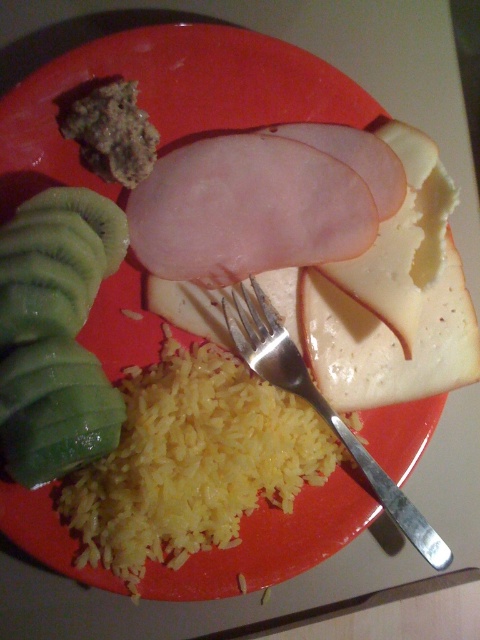
Question: Which object appears farthest from the camera in this image?

Choices:
 (A) silver metallic fork at center
 (B) white/semi-hard cheese at center

Answer: (B)

Question: Considering the real-world distances, which object is farthest from the white/semi-hard cheese at center?

Choices:
 (A) silver metallic fork at center
 (B) yellow matte rice at center

Answer: (B)

Question: Does white/semi-hard cheese at center come behind green juicy kiwi at left?

Choices:
 (A) yes
 (B) no

Answer: (A)

Question: Considering the relative positions of white/semi-hard cheese at center and green juicy kiwi at left in the image provided, where is white/semi-hard cheese at center located with respect to green juicy kiwi at left?

Choices:
 (A) right
 (B) left

Answer: (A)

Question: Can you confirm if yellow matte rice at center is smaller than green juicy kiwi at left?

Choices:
 (A) yes
 (B) no

Answer: (B)

Question: Which point is farther to the camera?

Choices:
 (A) (371, 483)
 (B) (257, 401)
 (C) (60, 412)
 (D) (83, 189)

Answer: (A)